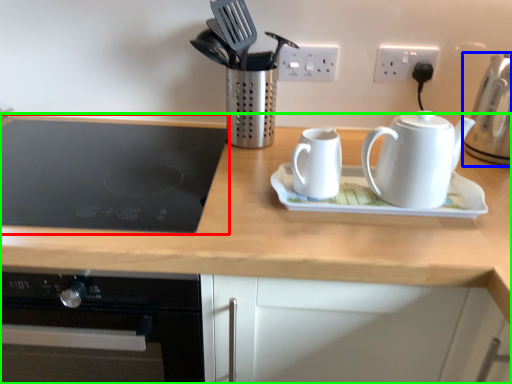
Question: Based on their relative distances, which object is nearer to gas stove (highlighted by a red box)? Choose from kettle (highlighted by a blue box) and countertop (highlighted by a green box).

Choices:
 (A) kettle
 (B) countertop

Answer: (B)